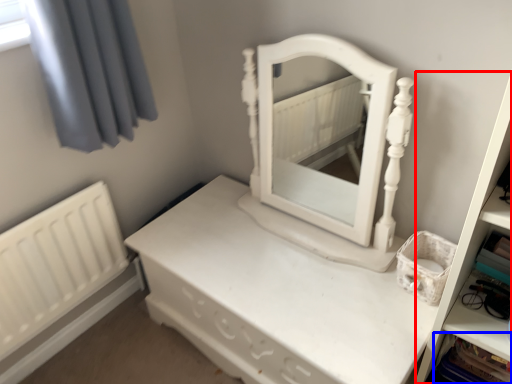
Question: Which object appears farthest to the camera in this image, bookshelf (highlighted by a red box) or cabinet (highlighted by a blue box)?

Choices:
 (A) bookshelf
 (B) cabinet

Answer: (B)